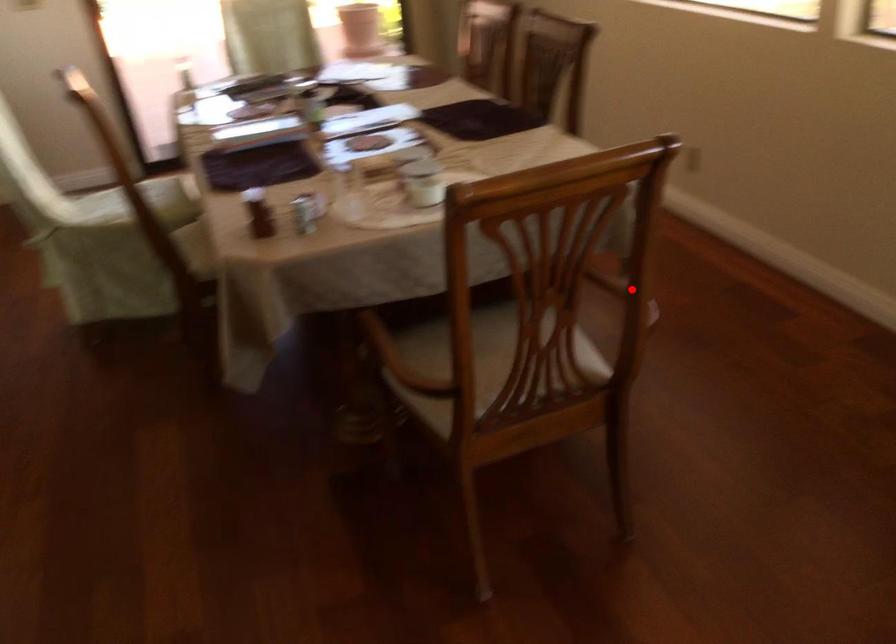
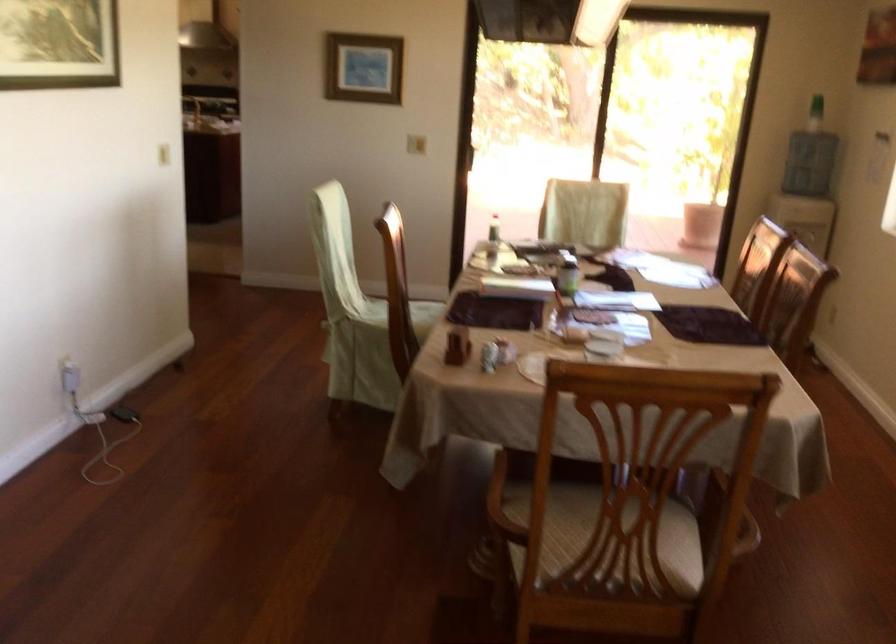
In the second image, find the point that corresponds to the highlighted location in the first image.

(722, 509)